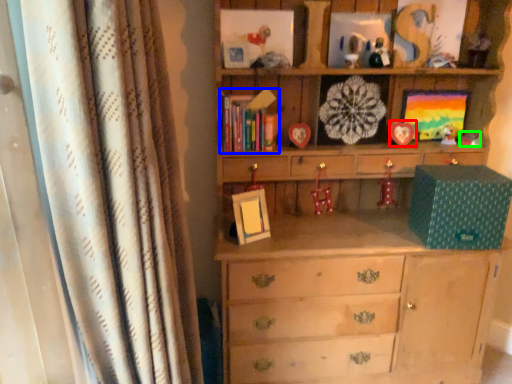
Question: Estimate the real-world distances between objects in this image. Which object is farther from picture frame (highlighted by a red box), book (highlighted by a blue box) or toy (highlighted by a green box)?

Choices:
 (A) book
 (B) toy

Answer: (A)